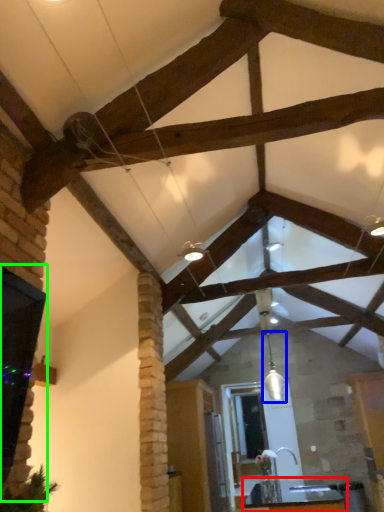
Question: Which is nearer to the table (highlighted by a red box)? light fixture (highlighted by a blue box) or window (highlighted by a green box).

Choices:
 (A) light fixture
 (B) window

Answer: (A)